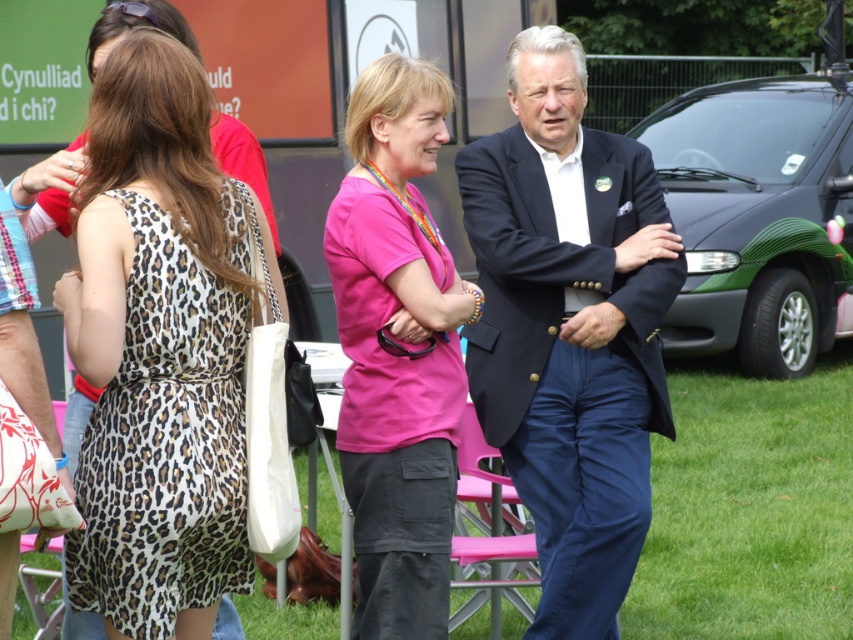
You are a photographer taking a picture of the green grass at center and the pink fabric shirt at center. Which object is closer to the camera?

The pink fabric shirt at center is closer to the camera because the green grass at center is positioned under it.

What is the color of the grass at the point with coordinates (749, 508)?

The grass at the point with coordinates (749, 508) is green.